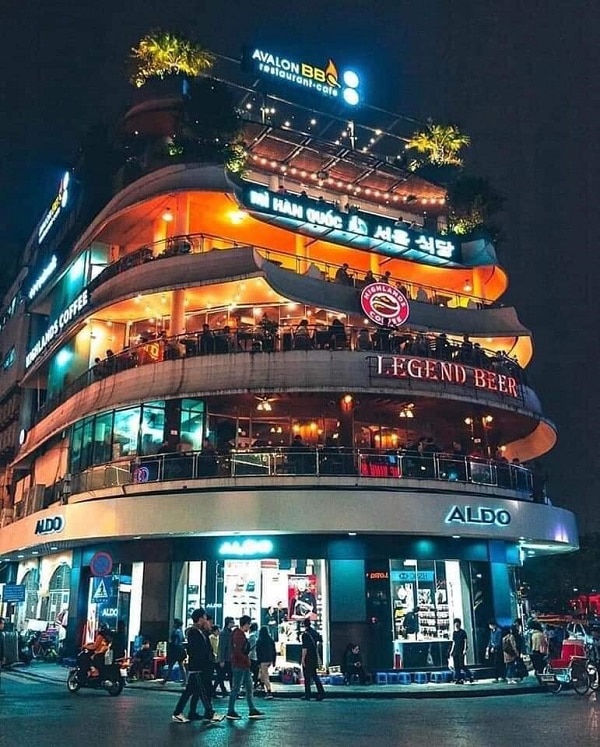
Where is `chair`? This screenshot has width=600, height=747. chair is located at coordinates (148, 669), (165, 662).